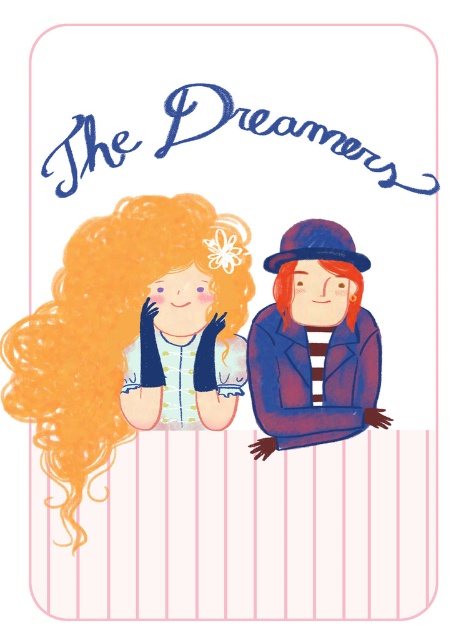
Looking at the image described, where is the golden curly hair at left located in terms of coordinates?

The golden curly hair at left is located at coordinates point (x=131, y=337).

Looking at the two objects in the image, the golden curly hair at left and the matte blue hat at center, which one appears wider?

The golden curly hair at left appears wider than the matte blue hat at center because its width surpasses the hat.